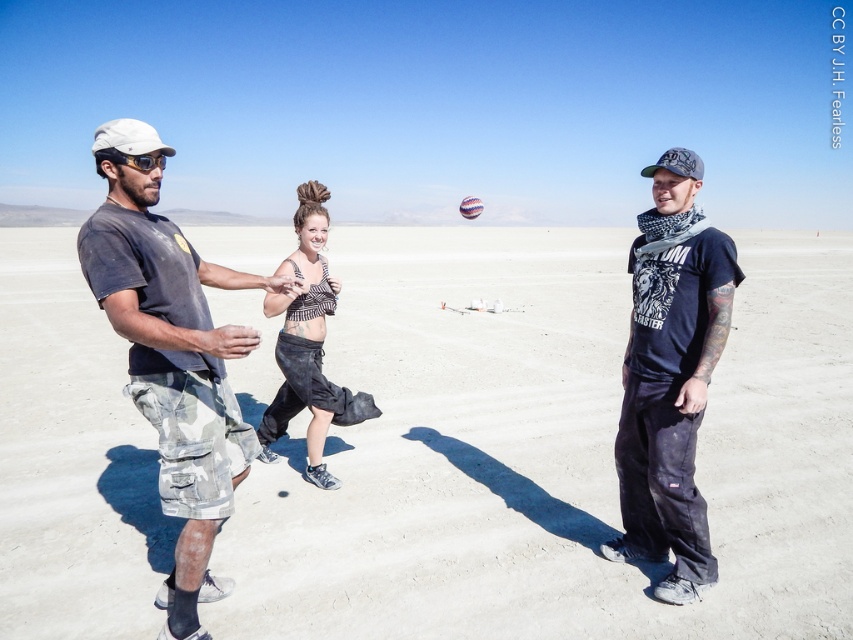
Question: Is the position of white sand at center more distant than that of dark blue cotton t-shirt at right?

Choices:
 (A) no
 (B) yes

Answer: (B)

Question: Which of the following is the closest to the observer?

Choices:
 (A) (299, 596)
 (B) (196, 525)

Answer: (B)

Question: Is white sand at center positioned at the back of camouflage cargo shorts at left?

Choices:
 (A) yes
 (B) no

Answer: (A)

Question: Does dark blue cotton t-shirt at right have a lesser width compared to black denim skirt at center?

Choices:
 (A) no
 (B) yes

Answer: (B)

Question: Which of these objects is positioned farthest from the white sand at center?

Choices:
 (A) black denim skirt at center
 (B) camouflage cargo shorts at left
 (C) dark blue cotton t-shirt at right

Answer: (C)

Question: Which point appears closest to the camera in this image?

Choices:
 (A) (277, 268)
 (B) (708, 301)
 (C) (138, 348)
 (D) (828, 605)

Answer: (C)